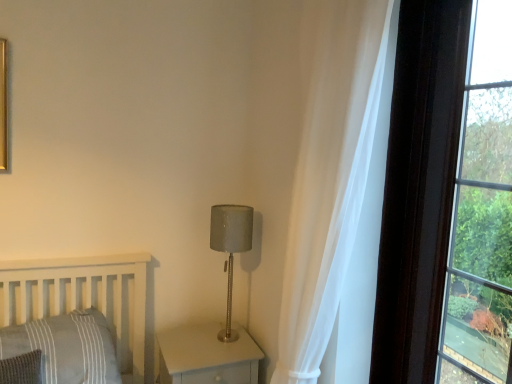
Find the location of a particular element. empty space that is ontop of matte gray wood nightstand at lower center (from a real-world perspective) is located at coordinates (203, 341).